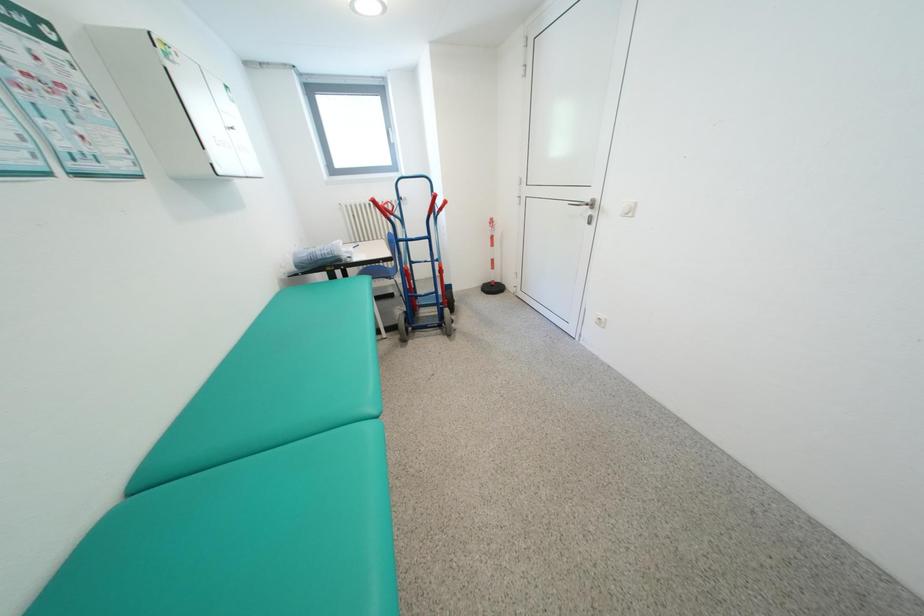
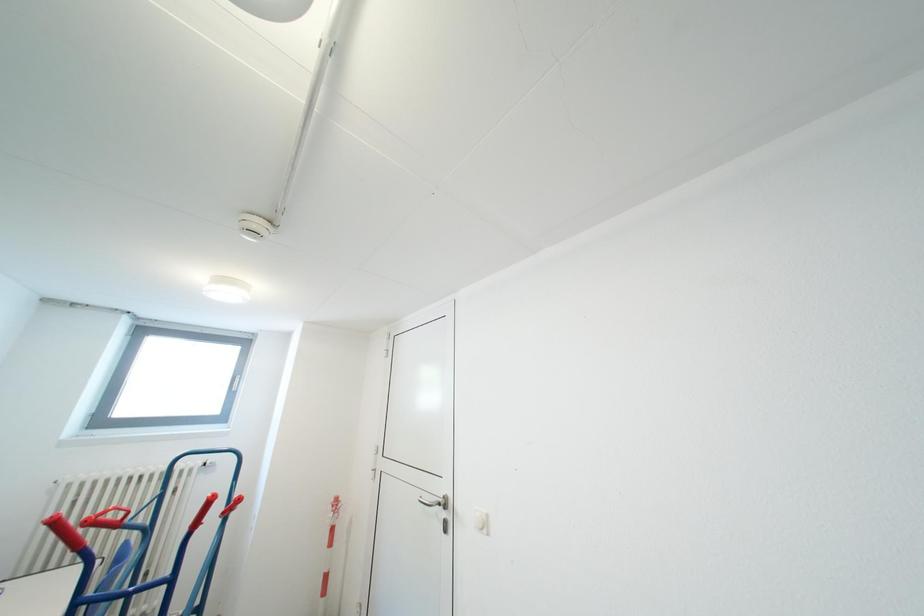
Looking at this image, the first image is from the beginning of the video and the second image is from the end. How did the camera likely rotate when shooting the video?

The rotation direction of the camera is right-up.